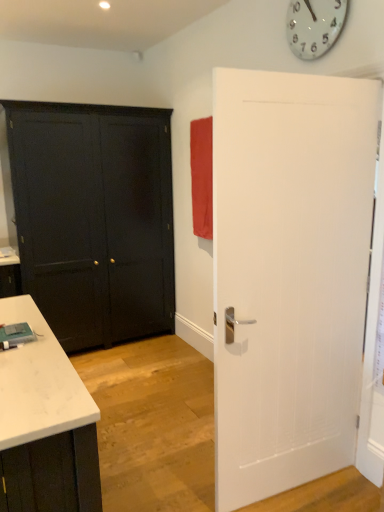
Question: From the image's perspective, would you say white textured door at right, which ranks as the 1th door in front-to-back order, is shown under matte red curtain at upper right?

Choices:
 (A) yes
 (B) no

Answer: (A)

Question: Are white textured door at right, positioned as the 2th door in left-to-right order, and matte red curtain at upper right beside each other?

Choices:
 (A) yes
 (B) no

Answer: (B)

Question: Is white textured door at right, positioned as the 2th door in left-to-right order, in front of matte red curtain at upper right?

Choices:
 (A) yes
 (B) no

Answer: (A)

Question: Can you confirm if white textured door at right, the second door positioned from the back, is thinner than matte red curtain at upper right?

Choices:
 (A) no
 (B) yes

Answer: (B)

Question: Would you say matte red curtain at upper right is part of white textured door at right, which is counted as the 1th door, starting from the right,'s contents?

Choices:
 (A) no
 (B) yes

Answer: (A)

Question: From a real-world perspective, is white textured door at right, positioned as the 2th door in left-to-right order, under matte red curtain at upper right?

Choices:
 (A) no
 (B) yes

Answer: (B)

Question: From the image's perspective, would you say white textured door at right, which ranks as the 1th door in front-to-back order, is shown under matte black door at left, arranged as the second door when viewed from the front?

Choices:
 (A) yes
 (B) no

Answer: (A)

Question: Considering the relative sizes of white textured door at right, the second door positioned from the back, and matte black door at left, the 2th door from the right, in the image provided, is white textured door at right, the second door positioned from the back, smaller than matte black door at left, the 2th door from the right,?

Choices:
 (A) no
 (B) yes

Answer: (B)

Question: From the image's perspective, does white textured door at right, which ranks as the 1th door in front-to-back order, appear higher than matte black door at left, arranged as the second door when viewed from the front?

Choices:
 (A) no
 (B) yes

Answer: (A)

Question: Is white textured door at right, the second door positioned from the back, beside matte black door at left, the 2th door from the right?

Choices:
 (A) yes
 (B) no

Answer: (B)

Question: Is white textured door at right, the second door positioned from the back, behind matte black door at left, acting as the first door starting from the left?

Choices:
 (A) no
 (B) yes

Answer: (A)

Question: Is white textured door at right, the second door positioned from the back, far away from matte black door at left, the 2th door from the right?

Choices:
 (A) no
 (B) yes

Answer: (B)

Question: Is white glossy clock at upper center further to camera compared to matte black door at left, arranged as the second door when viewed from the front?

Choices:
 (A) yes
 (B) no

Answer: (B)